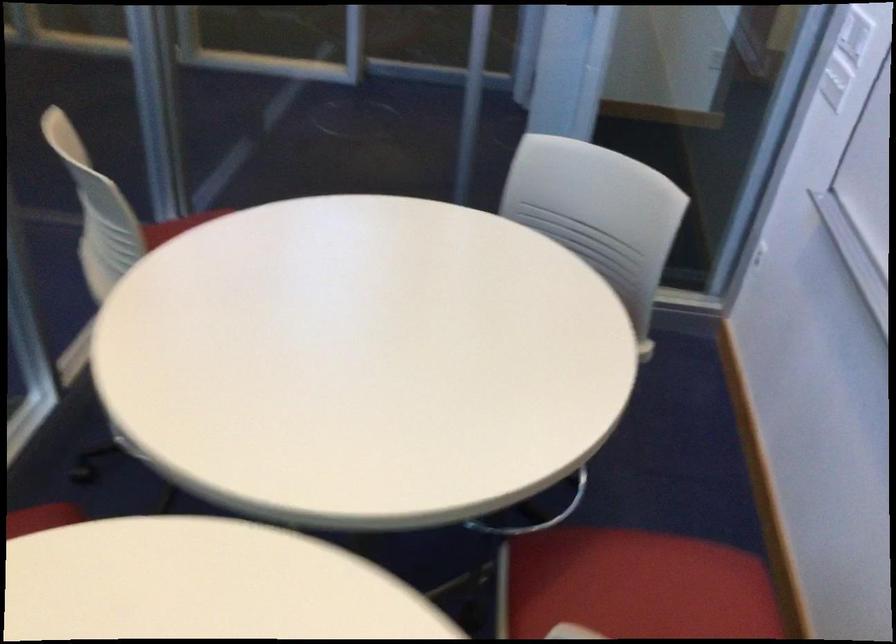
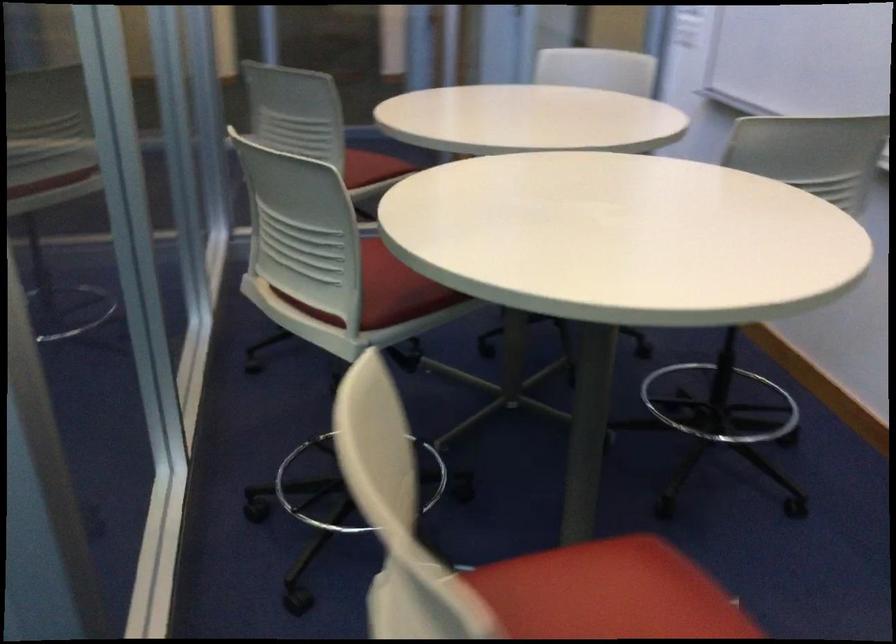
The images are taken continuously from a first-person perspective. In which direction are you moving?

The cameraman moved toward left, backward.